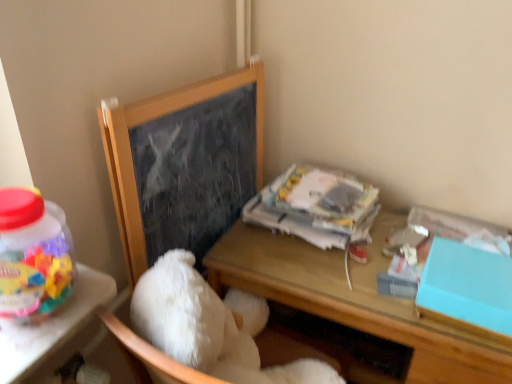
Image resolution: width=512 pixels, height=384 pixels. What are the coordinates of `white fluffy teddy bear at center` in the screenshot? It's located at (211, 326).

Find the location of a particular element. The image size is (512, 384). white paper at upper right is located at coordinates (316, 207).

Can you tell me how much wooden desk at center and white fluffy teddy bear at center differ in facing direction?

wooden desk at center and white fluffy teddy bear at center are facing 180 degrees away from each other.

From the image's perspective, is wooden desk at center located above white fluffy teddy bear at center?

Correct, wooden desk at center appears higher than white fluffy teddy bear at center in the image.

Considering their positions, is wooden desk at center located in front of or behind white fluffy teddy bear at center?

Clearly, wooden desk at center is behind white fluffy teddy bear at center.

Considering the sizes of objects teal matte box at right and wooden chalkboard at upper left in the image provided, who is taller, teal matte box at right or wooden chalkboard at upper left?

wooden chalkboard at upper left.

Image resolution: width=512 pixels, height=384 pixels. Identify the location of box below the wooden chalkboard at upper left (from a real-world perspective). (467, 289).

Is teal matte box at right to the left or to the right of wooden chalkboard at upper left in the image?

teal matte box at right is to the right of wooden chalkboard at upper left.

From the image's perspective, is white fluffy teddy bear at center under teal matte box at right?

Indeed, from the image's perspective, white fluffy teddy bear at center is shown beneath teal matte box at right.

From a real-world perspective, between white fluffy teddy bear at center and teal matte box at right, who is vertically lower?

From a 3D spatial view, white fluffy teddy bear at center is below.

Is white fluffy teddy bear at center turned away from teal matte box at right?

→ That's not correct — white fluffy teddy bear at center is not looking away from teal matte box at right.

Is the position of white fluffy teddy bear at center less distant than that of teal matte box at right?

Yes, white fluffy teddy bear at center is closer to the camera.

How different are the orientations of wooden desk at center and wooden chalkboard at upper left in degrees?

The angle between the facing direction of wooden desk at center and the facing direction of wooden chalkboard at upper left is 84.1 degrees.

Is wooden desk at center surrounding wooden chalkboard at upper left?

Definitely not — wooden chalkboard at upper left is not inside wooden desk at center.

From a real-world perspective, which is physically below, wooden desk at center or wooden chalkboard at upper left?

In real-world perspective, wooden desk at center is lower.

Is wooden desk at center touching teal matte box at right?

No, wooden desk at center is not touching teal matte box at right.

Looking at this image, from a real-world perspective, does wooden desk at center stand above teal matte box at right?

Incorrect, from a real-world perspective, wooden desk at center is lower than teal matte box at right.

Which point is more distant from viewer, (448, 339) or (484, 291)?

The point (448, 339) is behind.

Is white paper at upper right not near teal matte box at right?

Actually, white paper at upper right and teal matte box at right are a little close together.

From the image's perspective, is white paper at upper right on teal matte box at right?

Yes.

Is white paper at upper right facing towards teal matte box at right?

No.

Is white paper at upper right bigger than teal matte box at right?

Yes, white paper at upper right is bigger than teal matte box at right.

Which object is further away from the camera taking this photo, white fluffy teddy bear at center or white paper at upper right?

white paper at upper right.

Is point (170, 345) positioned behind point (347, 184)?

That is False.

Considering the relative positions of white fluffy teddy bear at center and white paper at upper right in the image provided, is white fluffy teddy bear at center to the right of white paper at upper right from the viewer's perspective?

Incorrect, white fluffy teddy bear at center is not on the right side of white paper at upper right.

Is the surface of white fluffy teddy bear at center in direct contact with white paper at upper right?

No, white fluffy teddy bear at center is not next to white paper at upper right.

The width and height of the screenshot is (512, 384). I want to click on teddy bear above the wooden desk at center (from a real-world perspective), so click(x=211, y=326).

This screenshot has width=512, height=384. Find the location of `bulletin board located on the left of teal matte box at right`. bulletin board located on the left of teal matte box at right is located at coordinates (184, 164).

When comparing their distances from teal matte box at right, does white paper at upper right or wooden desk at center seem closer?

Based on the image, wooden desk at center appears to be nearer to teal matte box at right.

Considering their positions, is wooden chalkboard at upper left positioned closer to wooden desk at center than teal matte box at right?

teal matte box at right is closer to wooden desk at center.

Estimate the real-world distances between objects in this image. Which object is further from wooden chalkboard at upper left, white fluffy teddy bear at center or wooden desk at center?

wooden desk at center lies further to wooden chalkboard at upper left than the other object.

Considering their positions, is teal matte box at right positioned closer to white fluffy teddy bear at center than white paper at upper right?

white paper at upper right is closer to white fluffy teddy bear at center.

When comparing their distances from wooden desk at center, does teal matte box at right or white fluffy teddy bear at center seem further?

Among the two, white fluffy teddy bear at center is located further to wooden desk at center.

Looking at the image, which one is located closer to white fluffy teddy bear at center, wooden desk at center or teal matte box at right?

The object closer to white fluffy teddy bear at center is wooden desk at center.

Which object lies nearer to the anchor point wooden chalkboard at upper left, teal matte box at right or white fluffy teddy bear at center?

Among the two, white fluffy teddy bear at center is located nearer to wooden chalkboard at upper left.

In the scene shown: Which object lies nearer to the anchor point wooden chalkboard at upper left, white paper at upper right or white fluffy teddy bear at center?

The object closer to wooden chalkboard at upper left is white paper at upper right.

You are a GUI agent. You are given a task and a screenshot of the screen. Output one action in this format:
    pyautogui.click(x=<x>, y=<y>)
    Task: Click on the paperback book located between white fluffy teddy bear at center and teal matte box at right in the left-right direction
    The width and height of the screenshot is (512, 384).
    Given the screenshot: What is the action you would take?
    pyautogui.click(x=316, y=207)

This screenshot has height=384, width=512. I want to click on desk that lies between wooden chalkboard at upper left and white fluffy teddy bear at center from top to bottom, so click(352, 299).

Locate an element on the screen. paperback book between wooden chalkboard at upper left and white fluffy teddy bear at center in the vertical direction is located at coordinates (316, 207).

You are a GUI agent. You are given a task and a screenshot of the screen. Output one action in this format:
    pyautogui.click(x=<x>, y=<y>)
    Task: Click on the desk between white paper at upper right and white fluffy teddy bear at center vertically
    This screenshot has width=512, height=384.
    Given the screenshot: What is the action you would take?
    pyautogui.click(x=352, y=299)